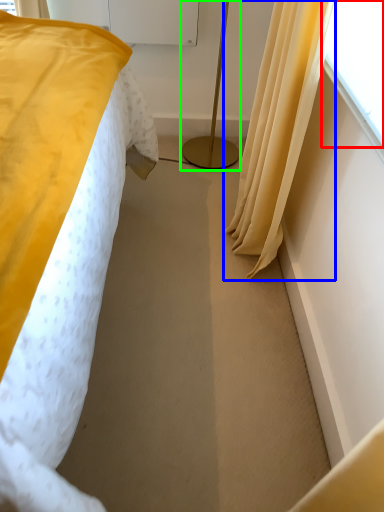
Question: Which is farther away from window screen (highlighted by a red box)? curtain (highlighted by a blue box) or bedside lamp (highlighted by a green box)?

Choices:
 (A) curtain
 (B) bedside lamp

Answer: (B)